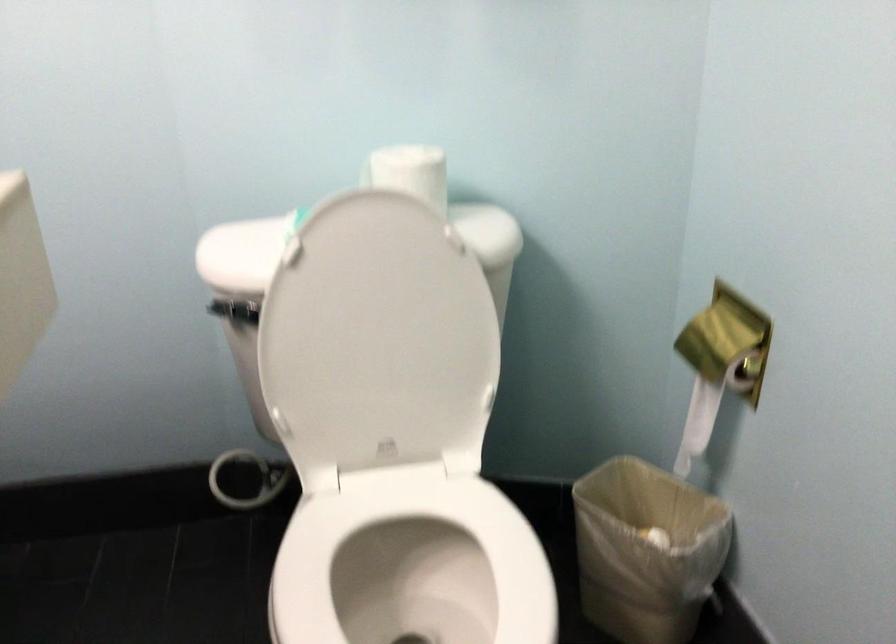
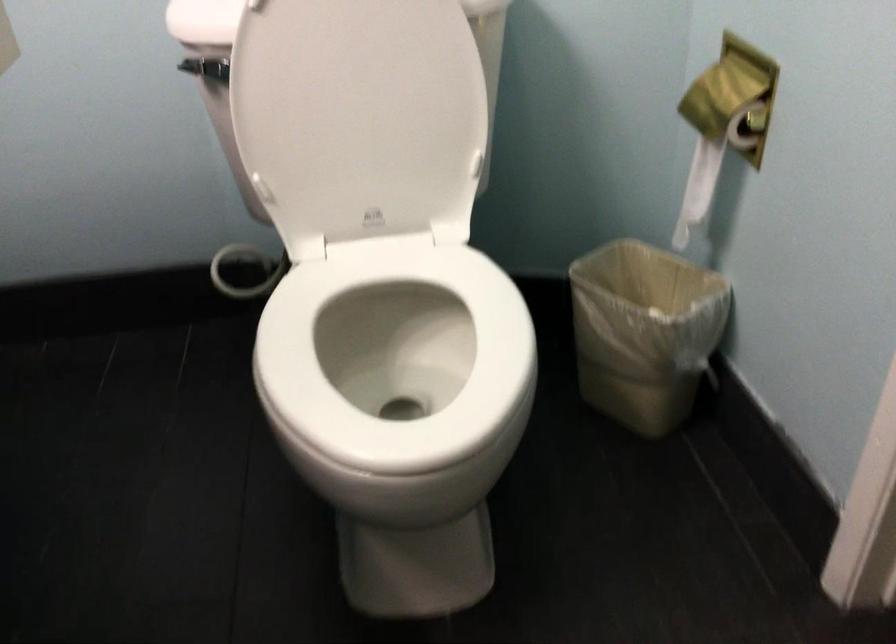
Where in the second image is the point corresponding to [719,337] from the first image?

(722, 91)